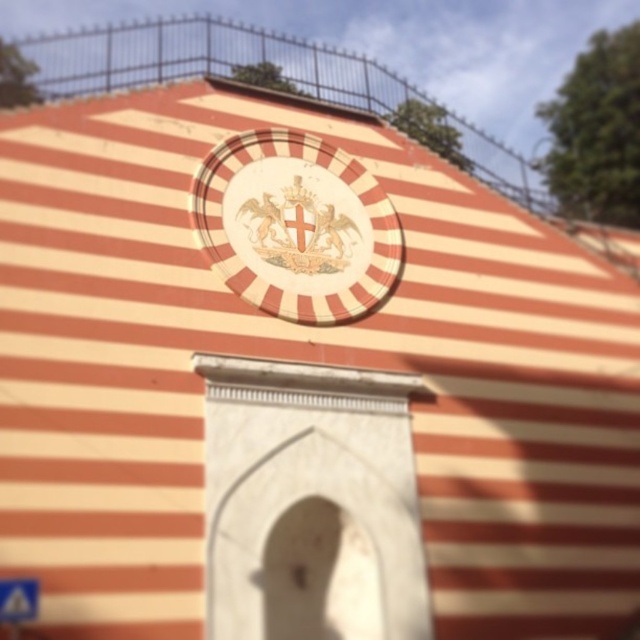
Image resolution: width=640 pixels, height=640 pixels. Identify the location of white glossy emblem at center. (296, 225).

Does white glossy emblem at center appear on the right side of blue plastic street sign at lower left?

Indeed, white glossy emblem at center is positioned on the right side of blue plastic street sign at lower left.

The height and width of the screenshot is (640, 640). What do you see at coordinates (296, 225) in the screenshot?
I see `white glossy emblem at center` at bounding box center [296, 225].

The width and height of the screenshot is (640, 640). Identify the location of white glossy emblem at center. (296, 225).